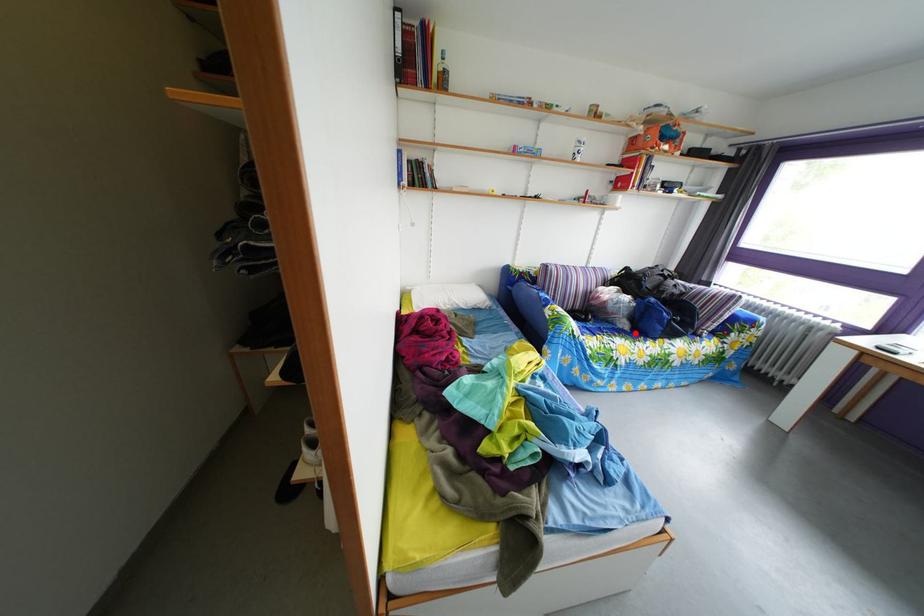
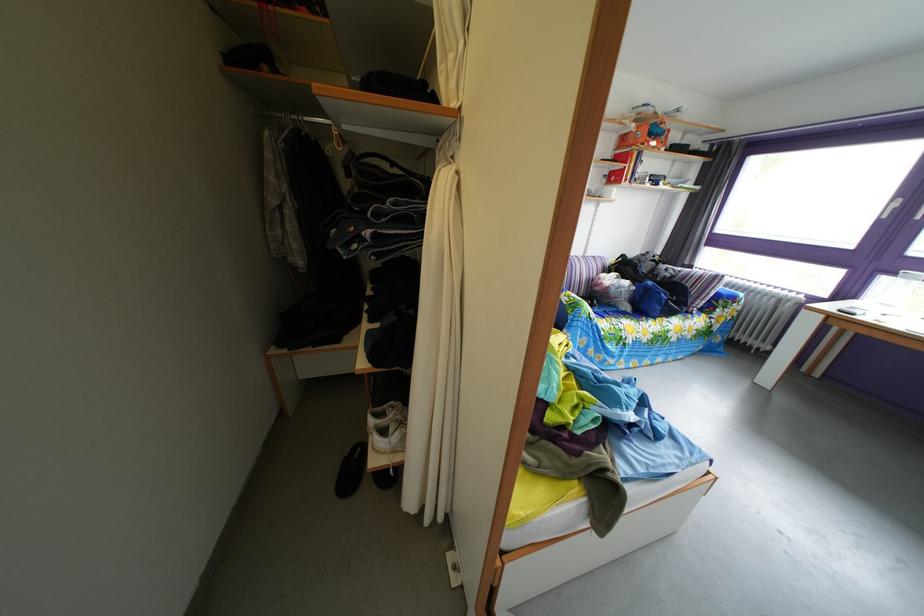
The point at the highlighted location is marked in the first image. Where is the corresponding point in the second image?

(638, 315)